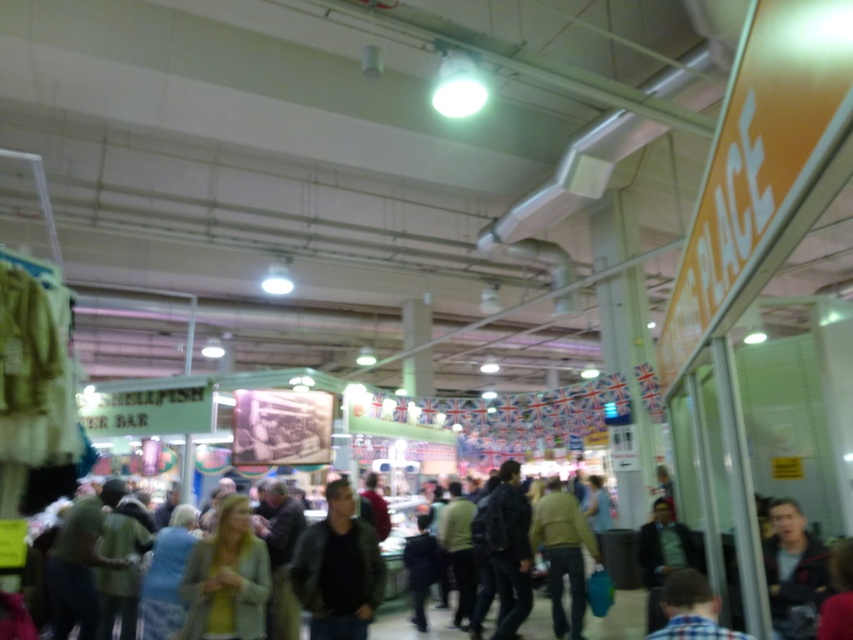
Question: Which object is the closest to the dark gray jacket at center?

Choices:
 (A) light brown leather jacket at center
 (B) dark brown leather jacket at center
 (C) light green fabric jacket at center
 (D) dark blue jacket at lower right

Answer: (A)

Question: Which object is farther from the camera taking this photo?

Choices:
 (A) plaid shirt at lower right
 (B) dark blue jacket at lower right

Answer: (B)

Question: Can you confirm if light green fabric jacket at center is bigger than dark blue jacket at lower right?

Choices:
 (A) no
 (B) yes

Answer: (B)

Question: Is dark brown leather jacket at center in front of plaid shirt at lower right?

Choices:
 (A) yes
 (B) no

Answer: (B)

Question: Which point is farther to the camera?

Choices:
 (A) (x=827, y=595)
 (B) (x=550, y=596)
 (C) (x=209, y=592)
 (D) (x=675, y=611)

Answer: (B)

Question: Is dark brown leather jacket at center positioned before plaid shirt at lower right?

Choices:
 (A) yes
 (B) no

Answer: (B)